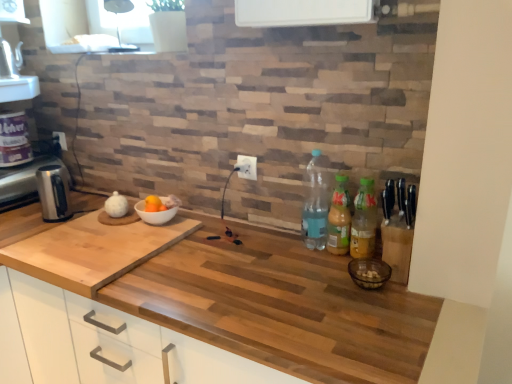
I want to click on vacant area in front of translucent plastic bottle at right, which ranks as the 1th bottle in left-to-right order, so click(x=315, y=271).